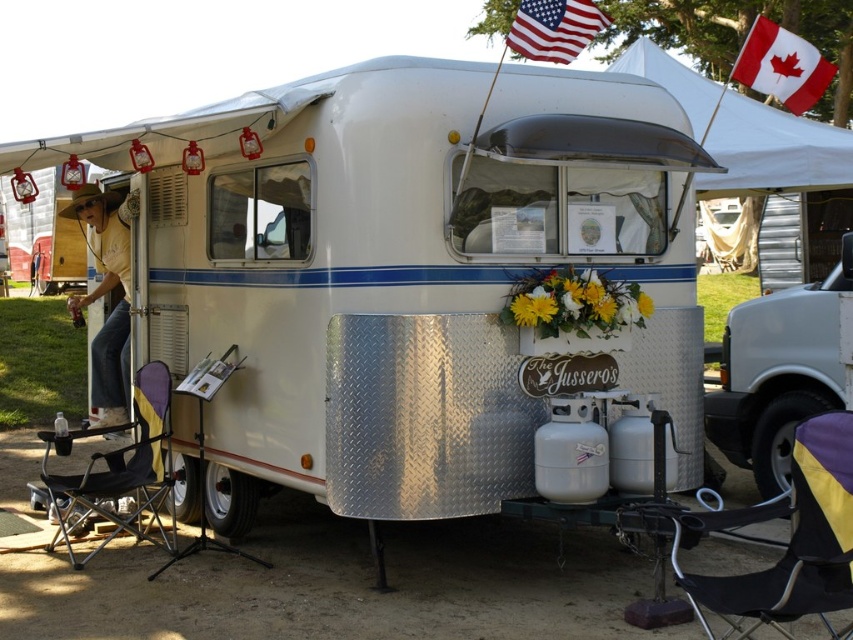
Who is positioned more to the right, denim jeans at left or red fabric flag at upper right?

red fabric flag at upper right is more to the right.

Does denim jeans at left have a greater width compared to red fabric flag at upper right?

No.

Locate an element on the screen. denim jeans at left is located at coordinates (113, 307).

Which of these two, yellow and purple fabric chair at lower right or denim jeans at left, stands taller?

Standing taller between the two is denim jeans at left.

Can you confirm if yellow and purple fabric chair at lower right is smaller than denim jeans at left?

Yes, yellow and purple fabric chair at lower right is smaller than denim jeans at left.

Identify the location of yellow and purple fabric chair at lower right. (x=788, y=540).

What are the coordinates of `yellow and purple fabric chair at lower right` in the screenshot? It's located at (788, 540).

The image size is (853, 640). What do you see at coordinates (399, 269) in the screenshot? I see `white aluminum trailer at center` at bounding box center [399, 269].

Between white aluminum trailer at center and white metallic camper at right, which one is positioned higher?

white aluminum trailer at center is higher up.

The image size is (853, 640). What are the coordinates of `white aluminum trailer at center` in the screenshot? It's located at (399, 269).

The height and width of the screenshot is (640, 853). What are the coordinates of `white aluminum trailer at center` in the screenshot? It's located at (399, 269).